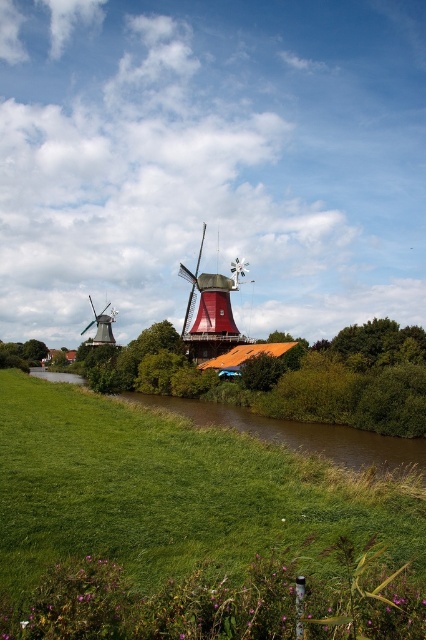
You are a photographer standing in the green grassy at center and want to take a picture of the matte red windmill at left. Can you see the entire windmill without any obstruction?

The green grassy at center is positioned under matte red windmill at left, so the grass might block the lower part of the windmill, making it difficult to capture the entire windmill in the photo.

You are standing at the edge of the river and want to place a small wooden bench. The bench requires a flat area with green grassy at center. According to the coordinates provided, where should you place the bench?

The green grassy at center is located at coordinates point (180,528), so the bench should be placed there.